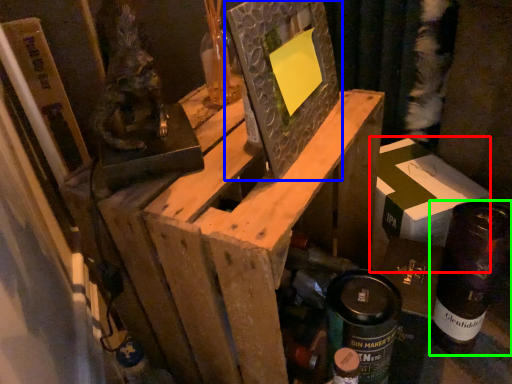
Question: Estimate the real-world distances between objects in this image. Which object is closer to cardboard box (highlighted by a red box), picture frame (highlighted by a blue box) or bottle (highlighted by a green box)?

Choices:
 (A) picture frame
 (B) bottle

Answer: (B)